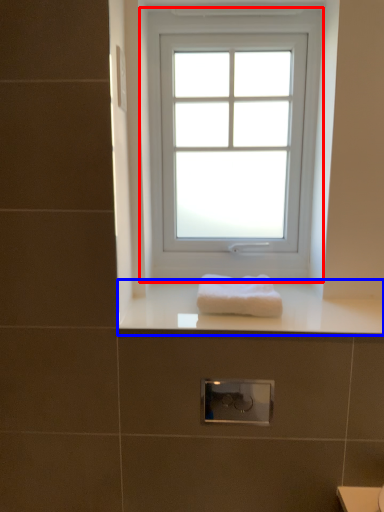
Question: Among these objects, which one is nearest to the camera, window (highlighted by a red box) or counter top (highlighted by a blue box)?

Choices:
 (A) window
 (B) counter top

Answer: (B)